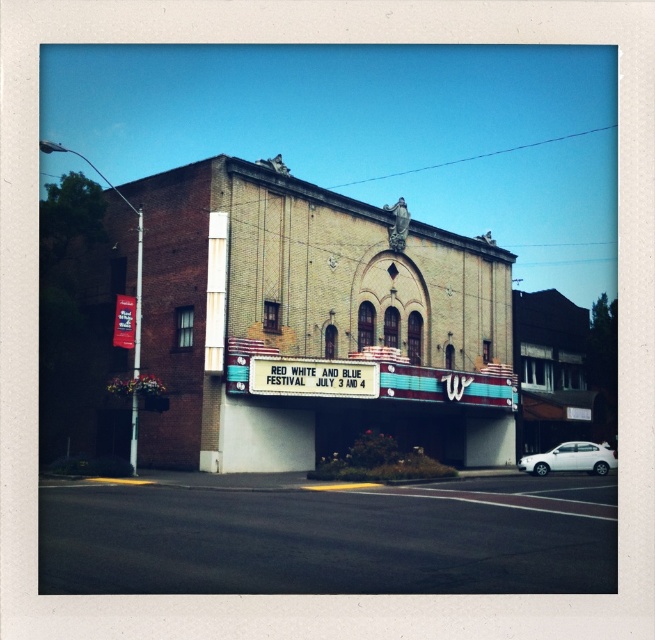
Does white marquee at center appear over white matte car at lower right?

Yes, white marquee at center is above white matte car at lower right.

Can you confirm if white marquee at center is smaller than white matte car at lower right?

Indeed, white marquee at center has a smaller size compared to white matte car at lower right.

The width and height of the screenshot is (655, 640). What are the coordinates of `white marquee at center` in the screenshot? It's located at (312, 378).

You are a GUI agent. You are given a task and a screenshot of the screen. Output one action in this format:
    pyautogui.click(x=<x>, y=<y>)
    Task: Click on the white marquee at center
    The height and width of the screenshot is (640, 655).
    Given the screenshot: What is the action you would take?
    pyautogui.click(x=312, y=378)

Does white matte car at lower right appear on the right side of matte red sign at left?

Correct, you'll find white matte car at lower right to the right of matte red sign at left.

Does point (548, 452) come behind point (126, 323)?

Yes, point (548, 452) is farther from viewer.

This screenshot has height=640, width=655. What do you see at coordinates (571, 458) in the screenshot? I see `white matte car at lower right` at bounding box center [571, 458].

Where is `white matte car at lower right`? This screenshot has width=655, height=640. white matte car at lower right is located at coordinates (571, 458).

Is white marquee at center closer to the viewer compared to matte red sign at left?

No, white marquee at center is behind matte red sign at left.

Between point (369, 372) and point (117, 323), which one is positioned in front?

Point (117, 323) is in front.

Is point (290, 358) closer to viewer compared to point (131, 348)?

No.

This screenshot has width=655, height=640. I want to click on white marquee at center, so click(x=312, y=378).